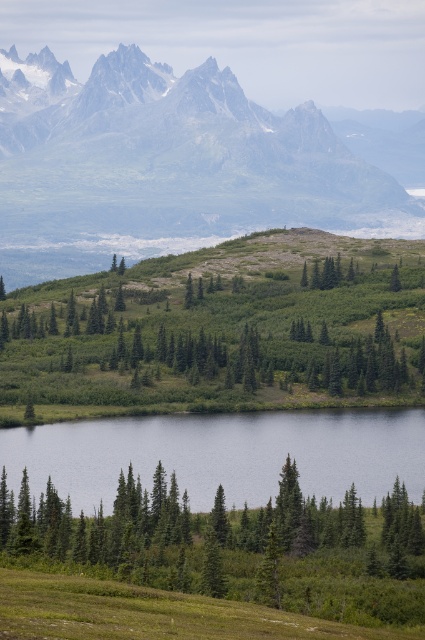
You are a hiker who wants to take a photo of the gray rocky mountain range at upper left and the green matte tree at lower left. From your current position, which object is higher in the frame?

The gray rocky mountain range at upper left is higher in the frame than the green matte tree at lower left because it is positioned above it.

You are an outdoor enthusiast planning a photography trip. You want to capture both the gray rocky mountain range at upper left and the smooth reflective water at lower center in the same frame. Given their sizes, which object will occupy more space in your photo?

The gray rocky mountain range at upper left will occupy more space in your photo because it is larger in size than the smooth reflective water at lower center according to the description.

You are a hiker standing at the base of the green matte tree at center. You want to take a photo of the smooth reflective water at lower center. Can you see it clearly from your current position?

The smooth reflective water at lower center is behind the green matte tree at center, so you cannot see it clearly from the base of the tree.